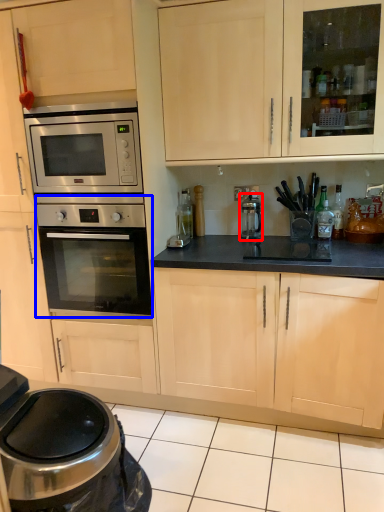
Question: Which of the following is the farthest to the observer, appliance (highlighted by a red box) or oven (highlighted by a blue box)?

Choices:
 (A) appliance
 (B) oven

Answer: (A)